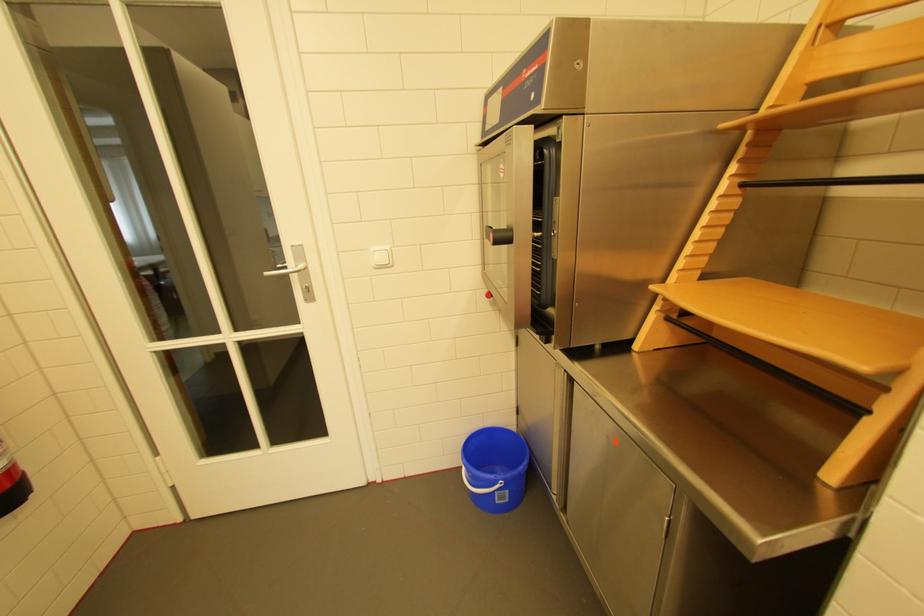
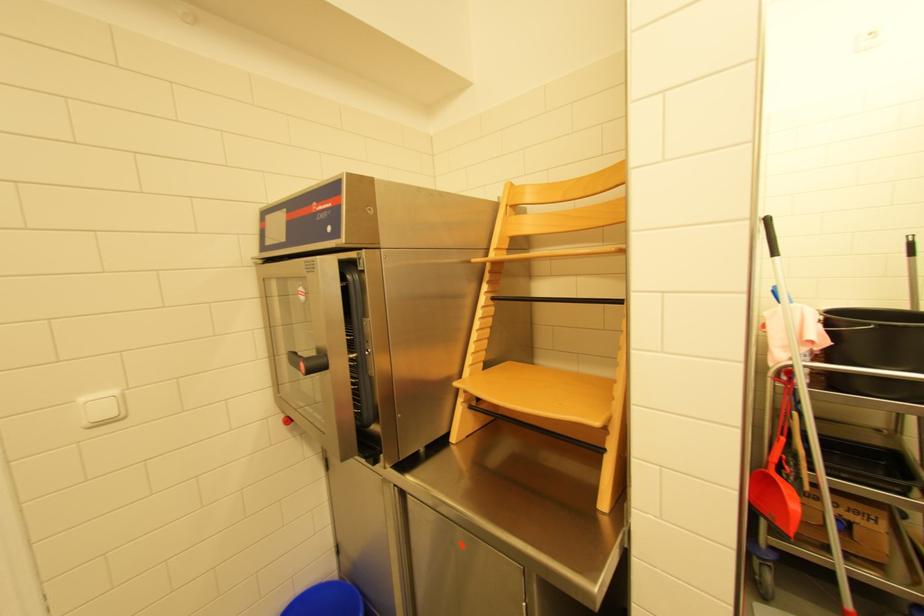
Question: The images are taken continuously from a first-person perspective. In which direction is your viewpoint rotating?

Choices:
 (A) Left
 (B) Right
 (C) Up
 (D) Down

Answer: (B)